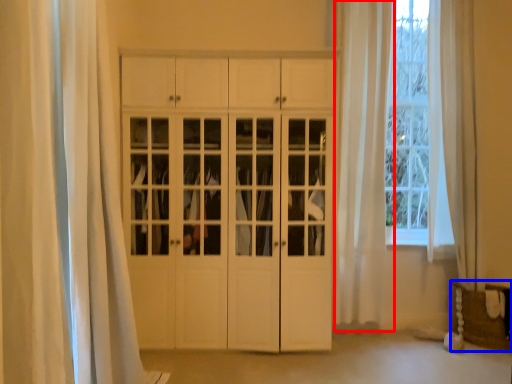
Question: Which of the following is the closest to the observer, curtain (highlighted by a red box) or furniture (highlighted by a blue box)?

Choices:
 (A) curtain
 (B) furniture

Answer: (B)